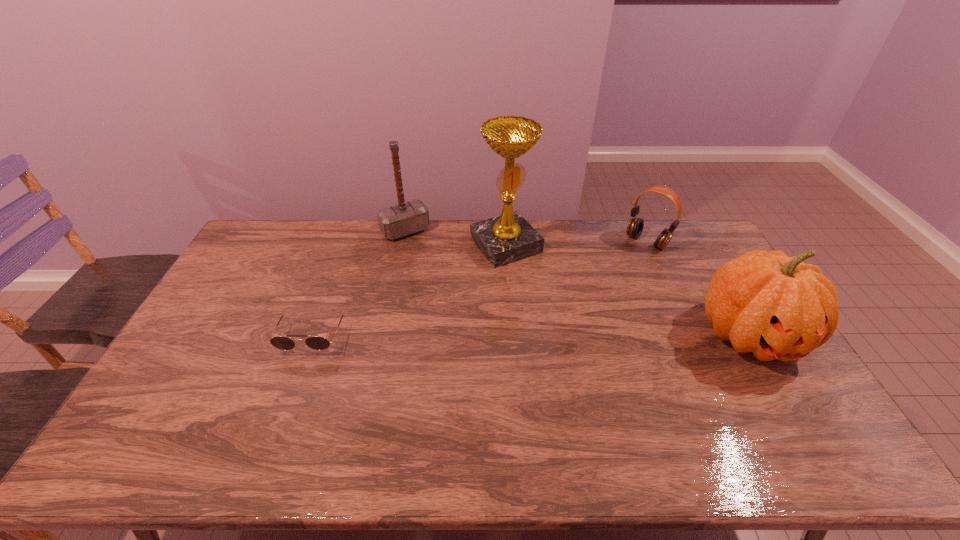
The image size is (960, 540). In order to click on free spot between the leftmost object and the pumpkin in this screenshot , I will do `click(532, 335)`.

The image size is (960, 540). What are the coordinates of `free space that is in between the tallest object and the pumpkin` in the screenshot? It's located at (628, 291).

This screenshot has width=960, height=540. I want to click on vacant space in between the second shortest object and the tallest object, so pos(576,244).

This screenshot has width=960, height=540. I want to click on vacant space that's between the sunglasses and the pumpkin, so click(532, 335).

The width and height of the screenshot is (960, 540). I want to click on unoccupied area between the third object from right to left and the shortest object, so click(x=410, y=290).

Image resolution: width=960 pixels, height=540 pixels. Identify the location of free area in between the third object from right to left and the second shortest object. (576, 244).

You are a GUI agent. You are given a task and a screenshot of the screen. Output one action in this format:
    pyautogui.click(x=<x>, y=<y>)
    Task: Click on the unoccupied area between the pumpkin and the headset
    
    Given the screenshot: What is the action you would take?
    pyautogui.click(x=698, y=288)

Locate which object is the closest to the second shortest object. Please provide its 2D coordinates. Your answer should be formatted as a tuple, i.e. [(x, y)], where the tuple contains the x and y coordinates of a point satisfying the conditions above.

[(777, 307)]

Locate an element on the screen. object that is the fourth closest one to the second object from left to right is located at coordinates (777, 307).

At what (x,y) coordinates should I click in order to perform the action: click on free location that satisfies the following two spatial constraints: 1. on the front side of the hammer; 2. on the right side of the headset. Please return your answer as a coordinate pair (x, y). Looking at the image, I should click on (403, 241).